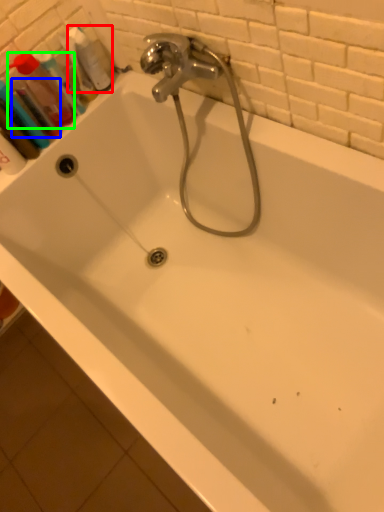
Question: Considering the real-world distances, which object is farthest from cleaning product (highlighted by a red box)? mouthwash (highlighted by a blue box) or mouthwash (highlighted by a green box)?

Choices:
 (A) mouthwash
 (B) mouthwash

Answer: (A)